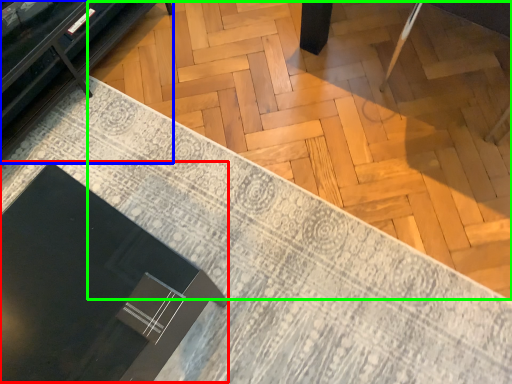
Question: Considering the real-world distances, which object is closest to round table (highlighted by a red box)? furniture (highlighted by a blue box) or plywood (highlighted by a green box).

Choices:
 (A) furniture
 (B) plywood

Answer: (A)